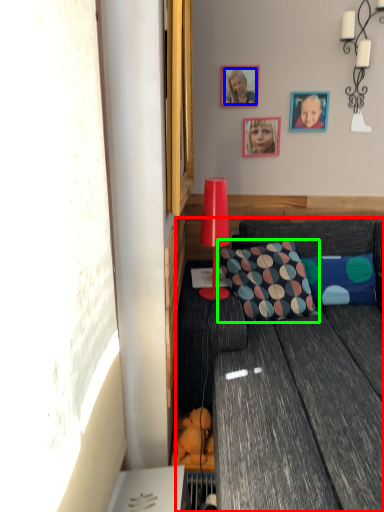
Question: Considering the real-world distances, which object is farthest from studio couch (highlighted by a red box)? person (highlighted by a blue box) or pillow (highlighted by a green box)?

Choices:
 (A) person
 (B) pillow

Answer: (A)